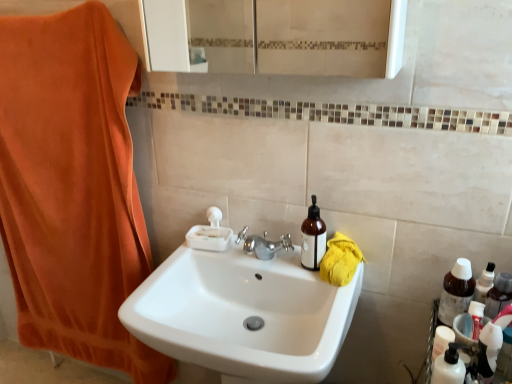
Where is `brown glass bottle at right, acting as the 1th bottle starting from the right`? brown glass bottle at right, acting as the 1th bottle starting from the right is located at coordinates (456, 291).

In order to face brown glass bottle at right, placed as the 2th bottle when sorted from left to right, should I rotate leftwards or rightwards?

Rotate right and turn 25.058 degrees.

This screenshot has height=384, width=512. Identify the location of white glossy sink at center. (243, 314).

What is the approximate width of white glossy sink at center?

It is 46.69 centimeters.

You are a GUI agent. You are given a task and a screenshot of the screen. Output one action in this format:
    pyautogui.click(x=<x>, y=<y>)
    Task: Click on the yellow cotton towel at right
    The height and width of the screenshot is (384, 512).
    Given the screenshot: What is the action you would take?
    pyautogui.click(x=340, y=260)

Find the location of a particular element. translucent plastic bottle at lower right is located at coordinates (449, 366).

In order to face orange cotton towel at left, should I rotate leftwards or rightwards?

Rotate left and turn 23.951 degrees.

In order to face brown glass bottle at upper right, the first bottle from the left, should I rotate leftwards or rightwards?

To face it directly, rotate right by 8.084 degrees.

Where is `brown glass bottle at right, acting as the 1th bottle starting from the right`? The image size is (512, 384). brown glass bottle at right, acting as the 1th bottle starting from the right is located at coordinates (456, 291).

Choose the correct answer: Is brown glass bottle at right, acting as the 1th bottle starting from the right, inside orange cotton towel at left or outside it?

brown glass bottle at right, acting as the 1th bottle starting from the right, lies outside orange cotton towel at left.

Consider the image. Is brown glass bottle at right, acting as the 1th bottle starting from the right, in front of or behind orange cotton towel at left in the image?

brown glass bottle at right, acting as the 1th bottle starting from the right, is positioned closer to the viewer than orange cotton towel at left.

Is brown glass bottle at right, placed as the 2th bottle when sorted from left to right, facing away from orange cotton towel at left?

No, brown glass bottle at right, placed as the 2th bottle when sorted from left to right, is not facing away from orange cotton towel at left.

Does point (461, 301) appear closer or farther from the camera than point (98, 97)?

Point (461, 301) is closer to the camera than point (98, 97).

From a real-world perspective, is orange cotton towel at left physically below yellow cotton towel at right?

Yes.

You are a GUI agent. You are given a task and a screenshot of the screen. Output one action in this format:
    pyautogui.click(x=<x>, y=<y>)
    Task: Click on the bath towel in front of the yellow cotton towel at right
    
    Given the screenshot: What is the action you would take?
    pyautogui.click(x=73, y=187)

Can you see orange cotton towel at left touching yellow cotton towel at right?

orange cotton towel at left and yellow cotton towel at right are not in contact.

Which of these two, translucent plastic toothpaste tube at lower right or white glossy sink at center, is thinner?

With smaller width is translucent plastic toothpaste tube at lower right.

Is translucent plastic toothpaste tube at lower right completely or partially outside of white glossy sink at center?

Yes, translucent plastic toothpaste tube at lower right is outside of white glossy sink at center.

Is the position of translucent plastic toothpaste tube at lower right less distant than that of white glossy sink at center?

No.

Is brown glass bottle at right, placed as the 2th bottle when sorted from left to right, at the left side of translucent plastic toothpaste tube at lower right?

No, brown glass bottle at right, placed as the 2th bottle when sorted from left to right, is not to the left of translucent plastic toothpaste tube at lower right.

Which of these two, brown glass bottle at right, acting as the 1th bottle starting from the right, or translucent plastic toothpaste tube at lower right, stands shorter?

Standing shorter between the two is translucent plastic toothpaste tube at lower right.

Is point (459, 292) less distant than point (494, 352)?

No, it is behind (494, 352).

Is translucent plastic toothpaste tube at lower right at the back of brown glass bottle at right, acting as the 1th bottle starting from the right?

No, translucent plastic toothpaste tube at lower right is not at the back of brown glass bottle at right, acting as the 1th bottle starting from the right.

Locate an element on the screen. The width and height of the screenshot is (512, 384). bottle that is on the right side of translucent plastic bottle at lower right is located at coordinates (456, 291).

Considering the relative sizes of translucent plastic bottle at lower right and brown glass bottle at right, acting as the 1th bottle starting from the right, in the image provided, is translucent plastic bottle at lower right smaller than brown glass bottle at right, acting as the 1th bottle starting from the right,?

Yes.

In the image, is translucent plastic bottle at lower right positioned in front of or behind brown glass bottle at right, acting as the 1th bottle starting from the right?

In the image, translucent plastic bottle at lower right appears in front of brown glass bottle at right, acting as the 1th bottle starting from the right.

Is brown glass bottle at right, acting as the 1th bottle starting from the right, at the back of translucent plastic bottle at lower right?

No, translucent plastic bottle at lower right is not facing away from brown glass bottle at right, acting as the 1th bottle starting from the right.

Does yellow cotton towel at right have a greater width compared to brown glass bottle at upper right, the first bottle from the left?

Correct, the width of yellow cotton towel at right exceeds that of brown glass bottle at upper right, the first bottle from the left.

Based on the photo, would you say yellow cotton towel at right is outside brown glass bottle at upper right, placed as the second bottle when sorted from right to left?

That's correct, yellow cotton towel at right is outside of brown glass bottle at upper right, placed as the second bottle when sorted from right to left.

This screenshot has width=512, height=384. In order to click on bottle located above the yellow cotton towel at right (from a real-world perspective) in this screenshot , I will do `click(313, 238)`.

Is brown glass bottle at right, placed as the 2th bottle when sorted from left to right, to the right of yellow cotton towel at right from the viewer's perspective?

Correct, you'll find brown glass bottle at right, placed as the 2th bottle when sorted from left to right, to the right of yellow cotton towel at right.

Identify the location of beach towel above the brown glass bottle at right, acting as the 1th bottle starting from the right (from a real-world perspective). The height and width of the screenshot is (384, 512). (340, 260).

Looking at this image, is brown glass bottle at right, acting as the 1th bottle starting from the right, far from yellow cotton towel at right?

They are positioned close to each other.

Find the location of a particular element. bath towel below the brown glass bottle at right, placed as the 2th bottle when sorted from left to right (from a real-world perspective) is located at coordinates (73, 187).

Identify the location of beach towel that appears below the orange cotton towel at left (from the image's perspective). The width and height of the screenshot is (512, 384). (340, 260).

Looking at the image, which one is located further to orange cotton towel at left, translucent plastic toothpaste tube at lower right or yellow cotton towel at right?

translucent plastic toothpaste tube at lower right is positioned further to the anchor orange cotton towel at left.

Based on their spatial positions, is brown glass bottle at upper right, the first bottle from the left, or brown glass bottle at right, placed as the 2th bottle when sorted from left to right, closer to translucent plastic toothpaste tube at lower right?

brown glass bottle at right, placed as the 2th bottle when sorted from left to right.

Based on their spatial positions, is translucent plastic toothpaste tube at lower right or brown glass bottle at right, placed as the 2th bottle when sorted from left to right, further from orange cotton towel at left?

Among the two, translucent plastic toothpaste tube at lower right is located further to orange cotton towel at left.

Estimate the real-world distances between objects in this image. Which object is closer to translucent plastic toothpaste tube at lower right, brown glass bottle at upper right, the first bottle from the left, or yellow cotton towel at right?

Among the two, yellow cotton towel at right is located nearer to translucent plastic toothpaste tube at lower right.

When comparing their distances from orange cotton towel at left, does brown glass bottle at upper right, placed as the second bottle when sorted from right to left, or translucent plastic bottle at lower right seem closer?

brown glass bottle at upper right, placed as the second bottle when sorted from right to left.

Estimate the real-world distances between objects in this image. Which object is further from orange cotton towel at left, translucent plastic toothpaste tube at lower right or translucent plastic bottle at lower right?

Among the two, translucent plastic toothpaste tube at lower right is located further to orange cotton towel at left.

When comparing their distances from brown glass bottle at upper right, the first bottle from the left, does translucent plastic toothpaste tube at lower right or white glossy sink at center seem further?

translucent plastic toothpaste tube at lower right is positioned further to the anchor brown glass bottle at upper right, the first bottle from the left.

Which object lies further to the anchor point orange cotton towel at left, translucent plastic bottle at lower right or brown glass bottle at right, placed as the 2th bottle when sorted from left to right?

Among the two, translucent plastic bottle at lower right is located further to orange cotton towel at left.

I want to click on cleaning product situated between yellow cotton towel at right and brown glass bottle at right, acting as the 1th bottle starting from the right, from left to right, so 449,366.

Locate an element on the screen. toiletry between brown glass bottle at upper right, placed as the second bottle when sorted from right to left, and brown glass bottle at right, acting as the 1th bottle starting from the right, from left to right is located at coordinates (489, 350).

Identify the location of cleaning product between yellow cotton towel at right and translucent plastic toothpaste tube at lower right in the horizontal direction. (449, 366).

Locate an element on the screen. The width and height of the screenshot is (512, 384). beach towel between orange cotton towel at left and brown glass bottle at right, placed as the 2th bottle when sorted from left to right is located at coordinates (340, 260).